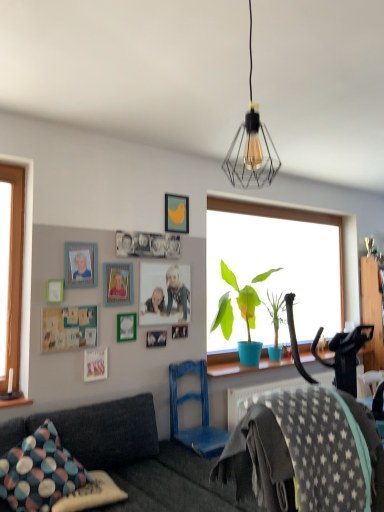
Question: Can you confirm if polka dot fabric pillow at lower left, arranged as the second pillow when viewed from the top, is wider than wooden dresser at right?

Choices:
 (A) yes
 (B) no

Answer: (A)

Question: Could you tell me if polka dot fabric pillow at lower left, arranged as the second pillow when viewed from the top, is turned towards wooden dresser at right?

Choices:
 (A) yes
 (B) no

Answer: (B)

Question: From the image's perspective, is polka dot fabric pillow at lower left, positioned as the 1th pillow in bottom-to-top order, above wooden dresser at right?

Choices:
 (A) yes
 (B) no

Answer: (B)

Question: Is the position of polka dot fabric pillow at lower left, positioned as the 1th pillow in bottom-to-top order, more distant than that of wooden dresser at right?

Choices:
 (A) no
 (B) yes

Answer: (A)

Question: Is polka dot fabric pillow at lower left, arranged as the second pillow when viewed from the top, smaller than wooden dresser at right?

Choices:
 (A) no
 (B) yes

Answer: (B)

Question: Is polka dot fabric pillow at lower left, arranged as the second pillow when viewed from the top, positioned beyond the bounds of wooden dresser at right?

Choices:
 (A) yes
 (B) no

Answer: (A)

Question: From the image's perspective, does wooden photo frame at center, which is the 3th picture frame in bottom-to-top order, appear higher than gray star-patterned fabric at lower right?

Choices:
 (A) no
 (B) yes

Answer: (B)

Question: Is wooden photo frame at center, placed as the 8th picture frame when sorted from top to bottom, at the right side of gray star-patterned fabric at lower right?

Choices:
 (A) no
 (B) yes

Answer: (A)

Question: Considering the relative sizes of wooden photo frame at center, which is the 3th picture frame in bottom-to-top order, and gray star-patterned fabric at lower right in the image provided, is wooden photo frame at center, which is the 3th picture frame in bottom-to-top order, taller than gray star-patterned fabric at lower right?

Choices:
 (A) yes
 (B) no

Answer: (B)

Question: From a real-world perspective, is wooden photo frame at center, placed as the 8th picture frame when sorted from top to bottom, physically below gray star-patterned fabric at lower right?

Choices:
 (A) yes
 (B) no

Answer: (B)

Question: Does wooden photo frame at center, which is the 3th picture frame in bottom-to-top order, have a greater width compared to gray star-patterned fabric at lower right?

Choices:
 (A) no
 (B) yes

Answer: (A)

Question: From a real-world perspective, is wooden photo frame at center, which is the 3th picture frame in bottom-to-top order, on gray star-patterned fabric at lower right?

Choices:
 (A) yes
 (B) no

Answer: (A)

Question: Is multicolored fabric pillow at lower left, the first pillow viewed from the top, not inside yellow matte picture frame at upper center, which appears as the first picture frame when viewed from the top?

Choices:
 (A) no
 (B) yes

Answer: (B)